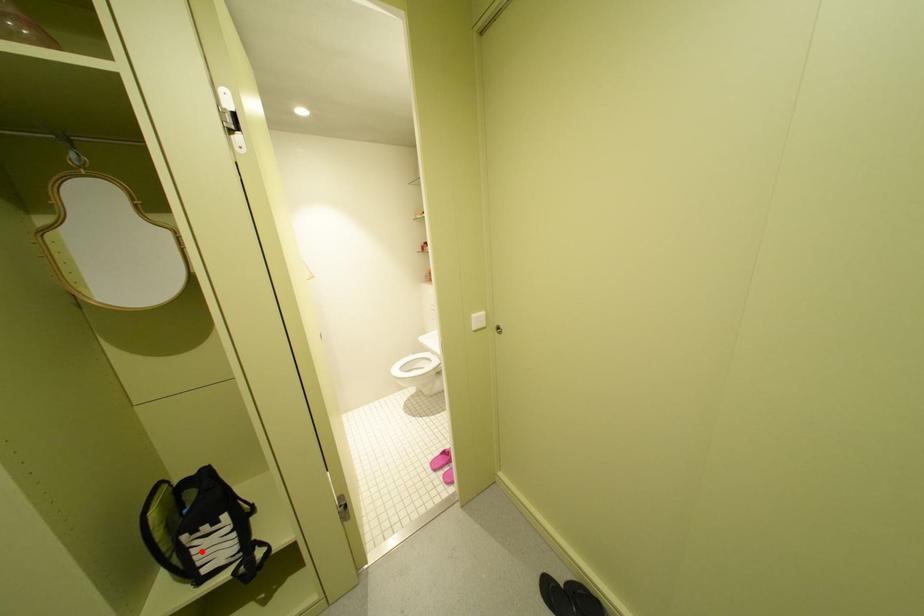
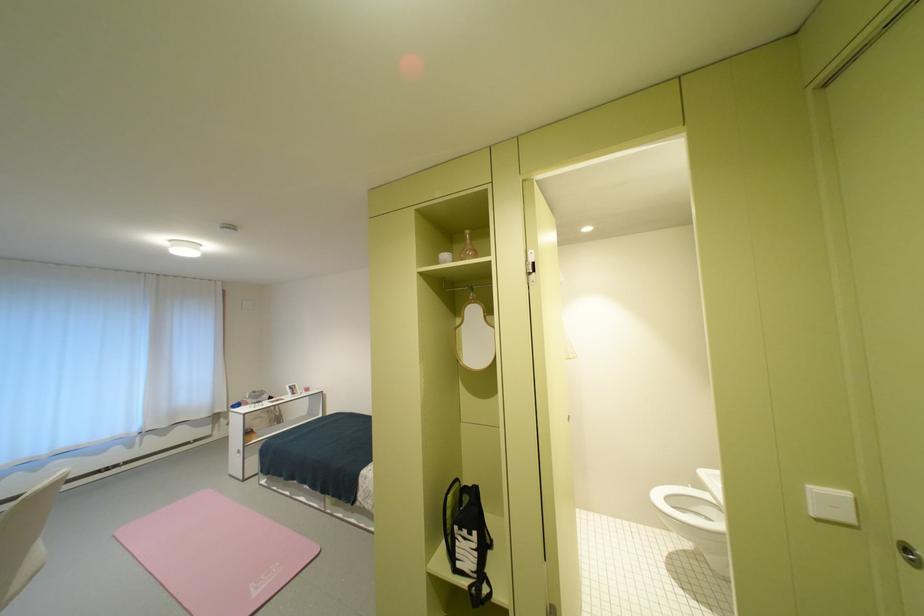
Question: I am providing you with two images of the same scene from different viewpoints. In image1, a red point is highlighted. Considering the same 3D point in image2, which of the following is correct?

Choices:
 (A) It is closer
 (B) It is farther

Answer: (B)